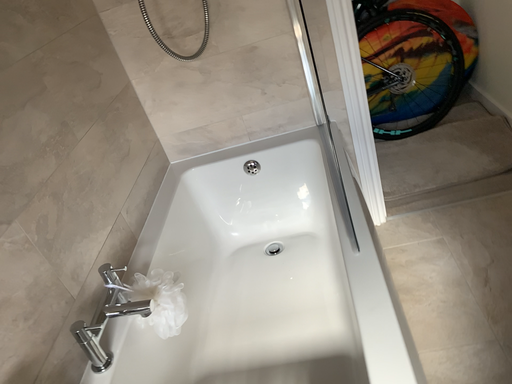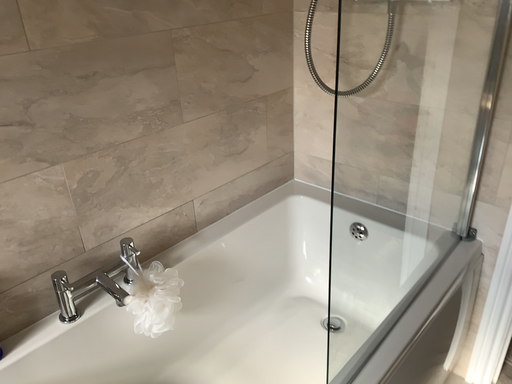
Question: How did the camera likely rotate when shooting the video?

Choices:
 (A) rotated downward
 (B) rotated upward

Answer: (B)